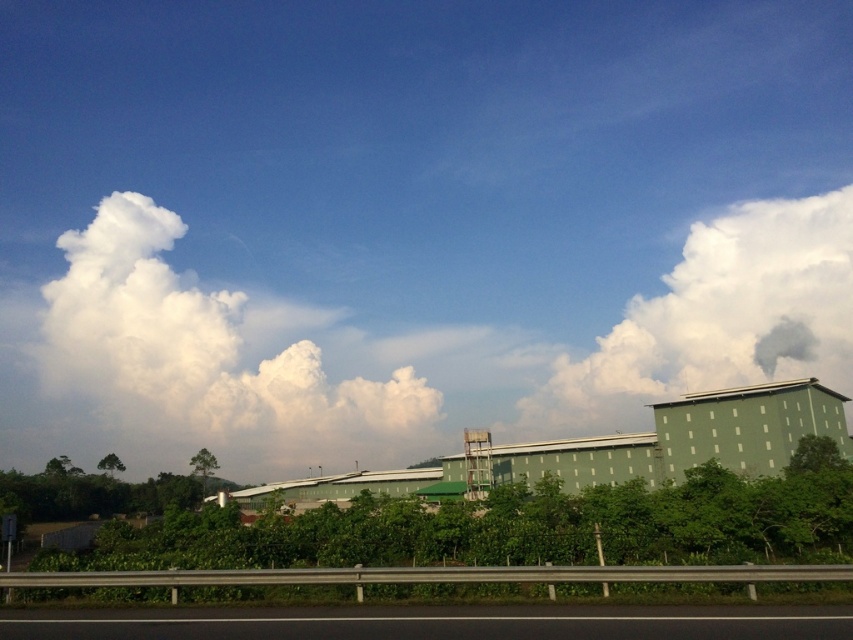
Based on the photo, can you confirm if white fluffy cloud at upper left is positioned below white fluffy cloud at upper right?

Indeed, white fluffy cloud at upper left is positioned under white fluffy cloud at upper right.

Based on the photo, between white fluffy cloud at upper left and white fluffy cloud at upper right, which one is positioned higher?

Positioned higher is white fluffy cloud at upper right.

Locate an element on the screen. Image resolution: width=853 pixels, height=640 pixels. white fluffy cloud at upper left is located at coordinates (210, 355).

Is point (793, 308) in front of point (537, 627)?

No, it is not.

Is the position of white fluffy cloud at upper right less distant than that of black asphalt highway at lower center?

No.

Does point (712, 273) lie behind point (161, 628)?

Yes.

I want to click on white fluffy cloud at upper right, so click(x=718, y=317).

Between white fluffy cloud at upper left and black asphalt highway at lower center, which one is positioned higher?

black asphalt highway at lower center

Does white fluffy cloud at upper left lie behind black asphalt highway at lower center?

Yes, it is behind black asphalt highway at lower center.

Is point (112, 243) less distant than point (329, 637)?

No.

I want to click on white fluffy cloud at upper left, so click(x=210, y=355).